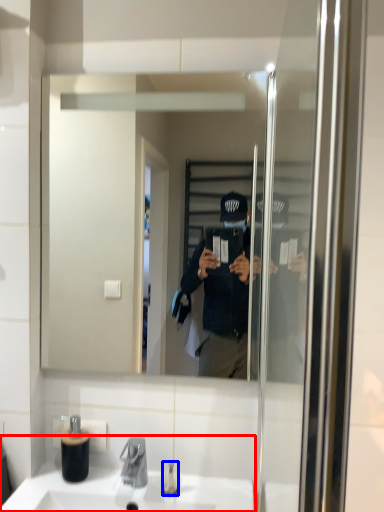
Question: Which object appears closest to the camera in this image, sink (highlighted by a red box) or toiletry (highlighted by a blue box)?

Choices:
 (A) sink
 (B) toiletry

Answer: (A)